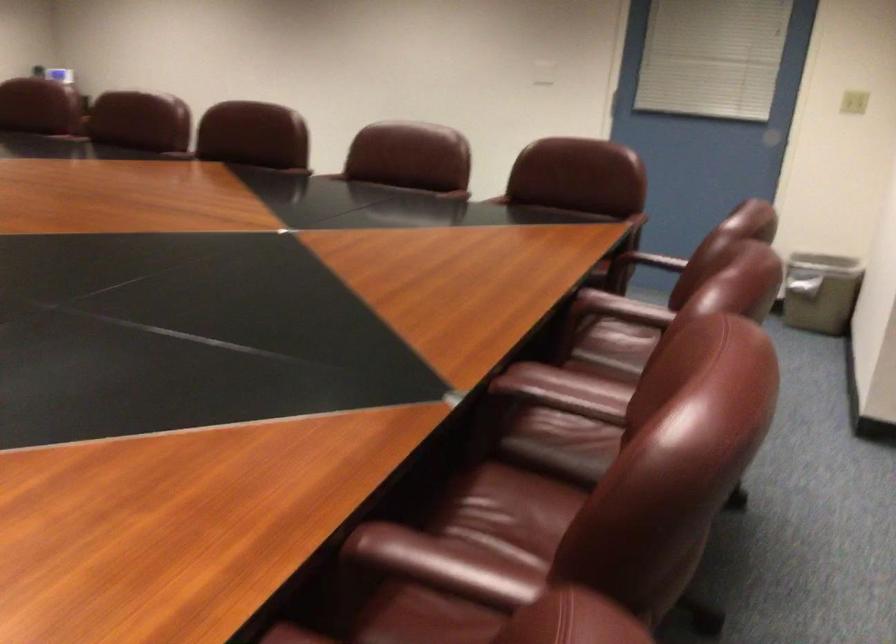
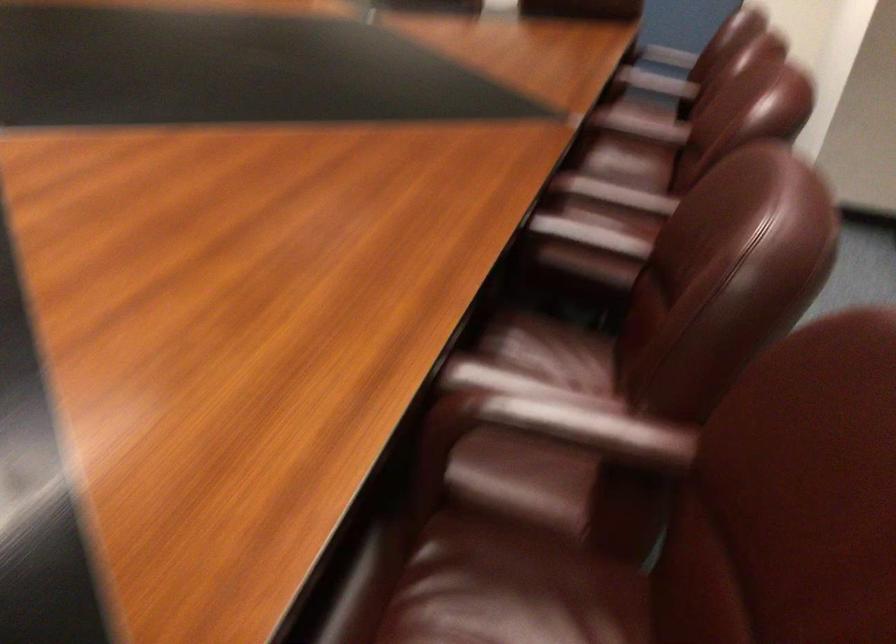
In the second image, find the point that corresponds to point (556, 404) in the first image.

(640, 126)